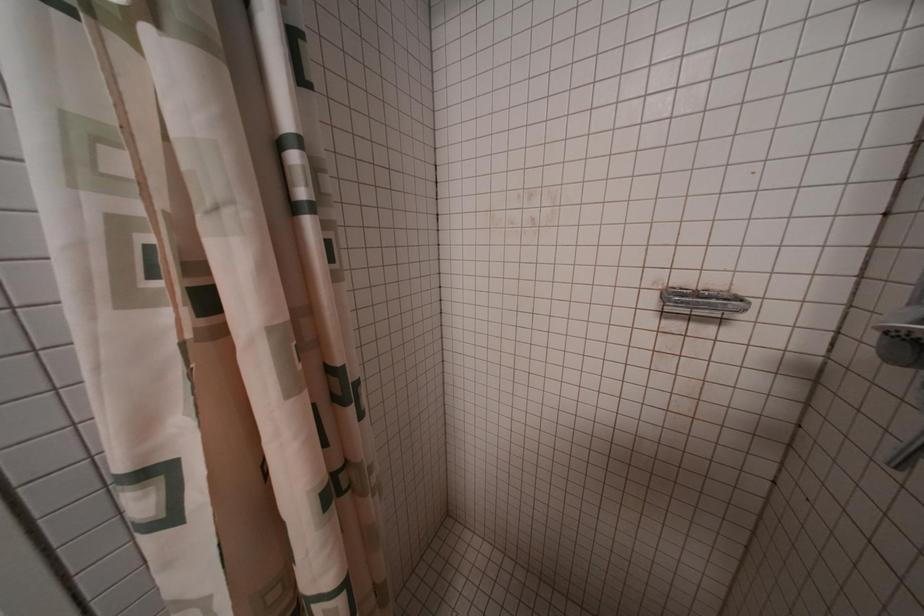
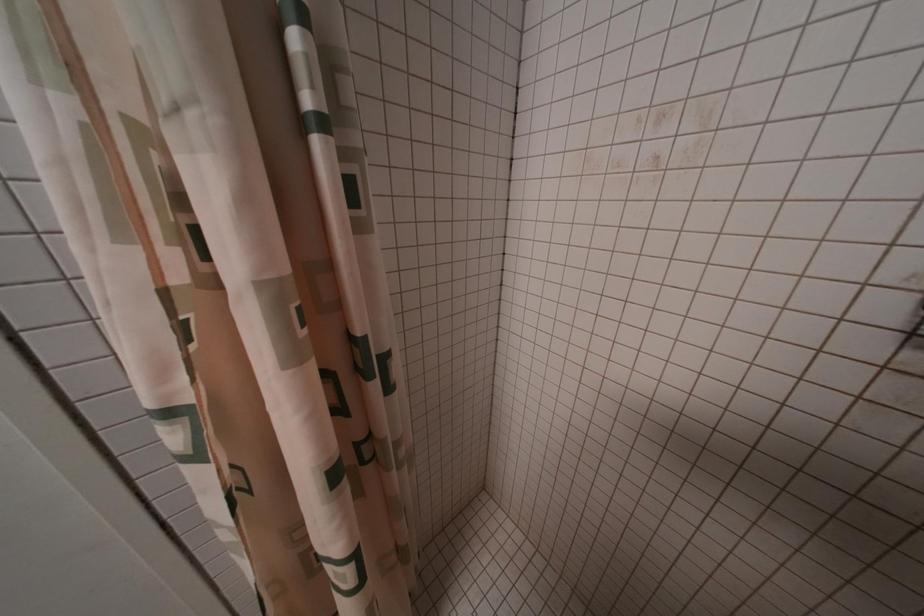
Question: The camera is either moving clockwise (left) or counter-clockwise (right) around the object. The first image is from the beginning of the video and the second image is from the end. Is the camera moving left or right when shooting the video?

Choices:
 (A) Left
 (B) Right

Answer: (B)